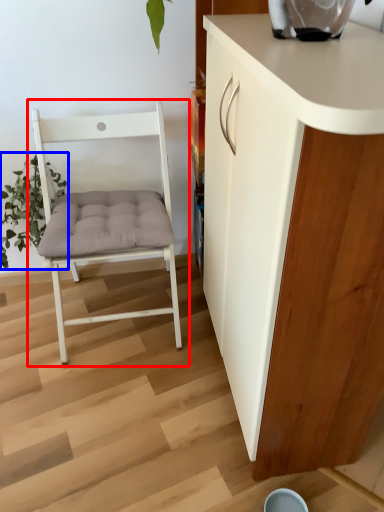
Question: Which point is closer to the camera, chair (highlighted by a red box) or plant (highlighted by a blue box)?

Choices:
 (A) chair
 (B) plant

Answer: (A)